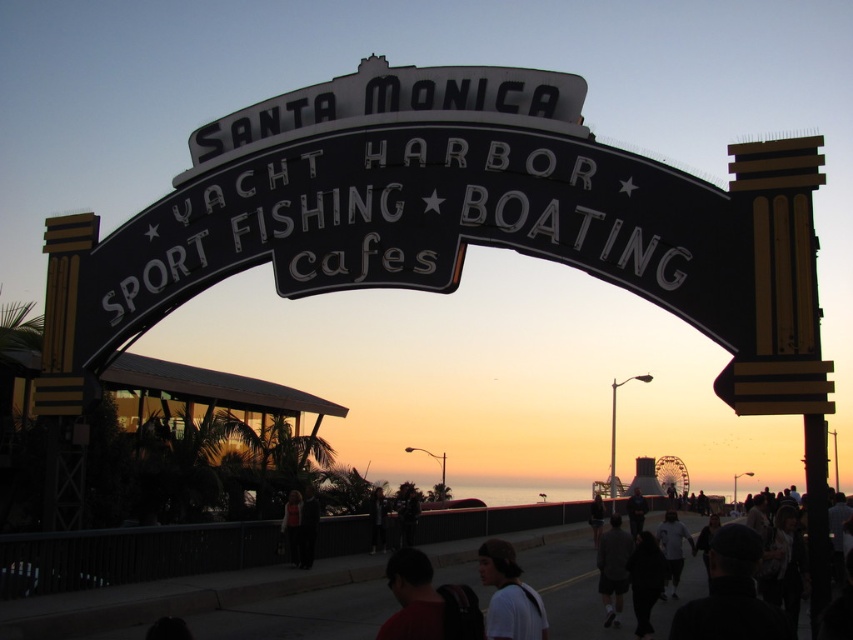
Based on the photo, you are a tour guide at Santa Monica Yacht Harbor and want to ensure that the dark gray hoodie at center and the dark brown leather jacket at lower center can hear your explanation. If your voice can carry up to 30 meters, will they both hear you?

The dark gray hoodie at center and the dark brown leather jacket at lower center are 26.68 meters apart from each other. Since the distance between them is within the 30 meters range of your voice, both can hear your explanation as long as there are no obstructions.

You are standing at the Santa Monica Yacht Harbor and see two people wearing a dark gray shirt at center and a matte black shirt at center. Which person is closer to you?

The dark gray shirt at center is closer to you because it is in front of the matte black shirt at center.

You are standing at the Santa Monica Yacht Harbor under the illuminated archway. You notice two jackets hanging on a rack near the walkway. The jackets are a dark brown leather jacket at center and a dark blue jacket at center. Which jacket is taller?

The dark brown leather jacket at center is taller than the dark blue jacket at center.